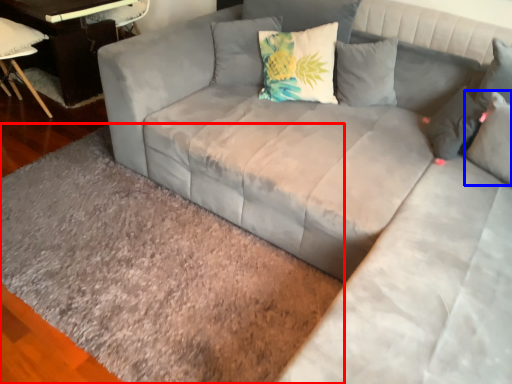
Question: Which object is further to the camera taking this photo, mat (highlighted by a red box) or pillow (highlighted by a blue box)?

Choices:
 (A) mat
 (B) pillow

Answer: (B)